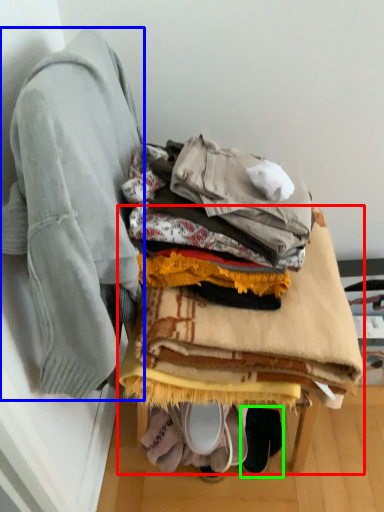
Question: Which is nearer to the furniture (highlighted by a red box)? jacket (highlighted by a blue box) or footwear (highlighted by a green box).

Choices:
 (A) jacket
 (B) footwear

Answer: (A)